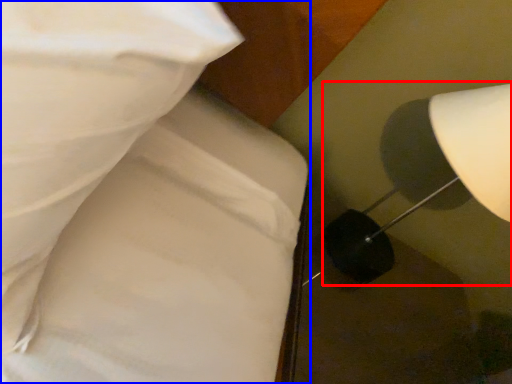
Question: Which point is further to the camera, lamp (highlighted by a red box) or bed (highlighted by a blue box)?

Choices:
 (A) lamp
 (B) bed

Answer: (A)